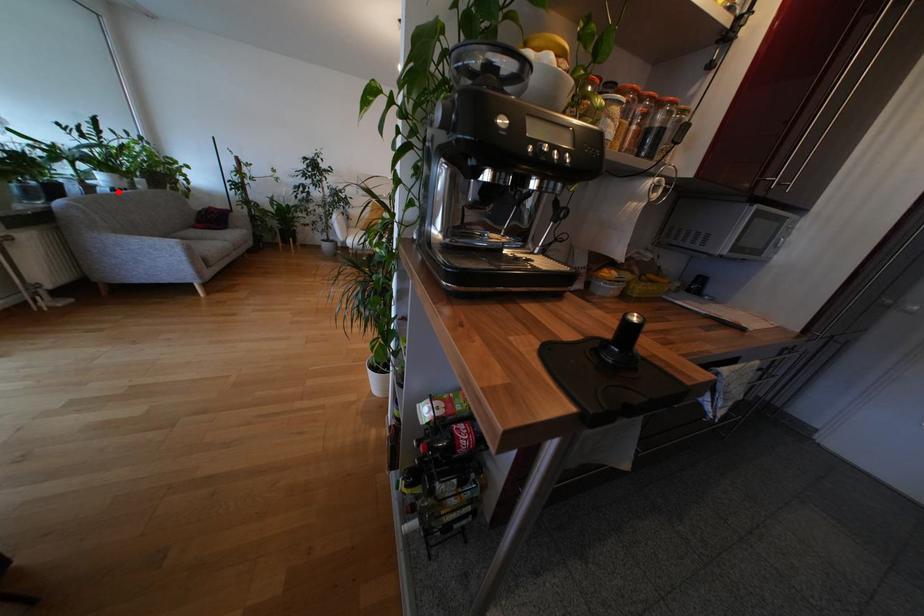
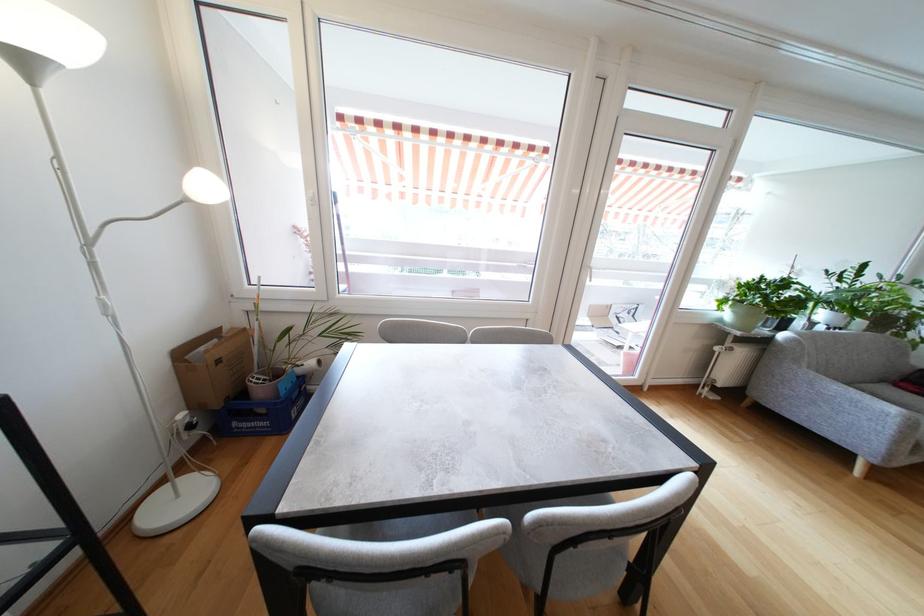
Question: I am providing you with two images of the same scene from different viewpoints. Image1 has a red point marked. In image2, the corresponding 3D location appears at what relative position? Reply with the corresponding letter.

Choices:
 (A) Closer
 (B) Farther

Answer: (A)